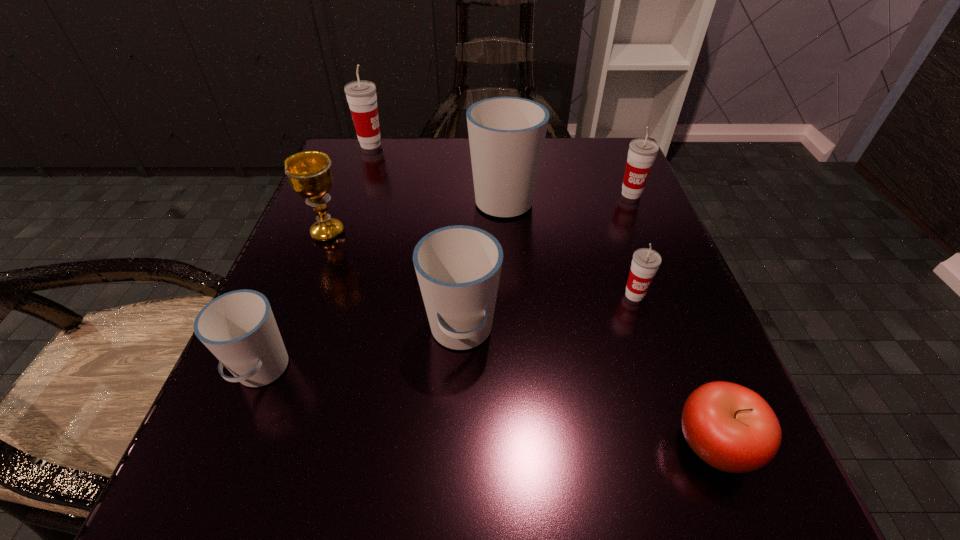
This screenshot has width=960, height=540. I want to click on vacant space at the far left corner of the desktop, so click(x=340, y=136).

In order to click on vacant point at the far right corner in this screenshot , I will do `click(617, 159)`.

Locate an element on the screen. Image resolution: width=960 pixels, height=540 pixels. free space at the near right corner is located at coordinates (667, 532).

Identify the location of empty space between the apple and the second biggest red cup. Image resolution: width=960 pixels, height=540 pixels. (673, 319).

This screenshot has height=540, width=960. I want to click on empty location between the leftmost white cup and the nearest object, so click(x=488, y=408).

The height and width of the screenshot is (540, 960). I want to click on free spot between the chalice and the rightmost red cup, so click(x=479, y=213).

Identify the location of empty space that is in between the second biggest red cup and the gold chalice. (479, 213).

Find the location of `empty location between the red apple and the gold chalice`. empty location between the red apple and the gold chalice is located at coordinates (521, 338).

The height and width of the screenshot is (540, 960). Identify the location of free point between the fifth cup from left to right and the apple. (675, 369).

The image size is (960, 540). What are the coordinates of `vacant space that's between the red apple and the biggest white cup` in the screenshot? It's located at (610, 321).